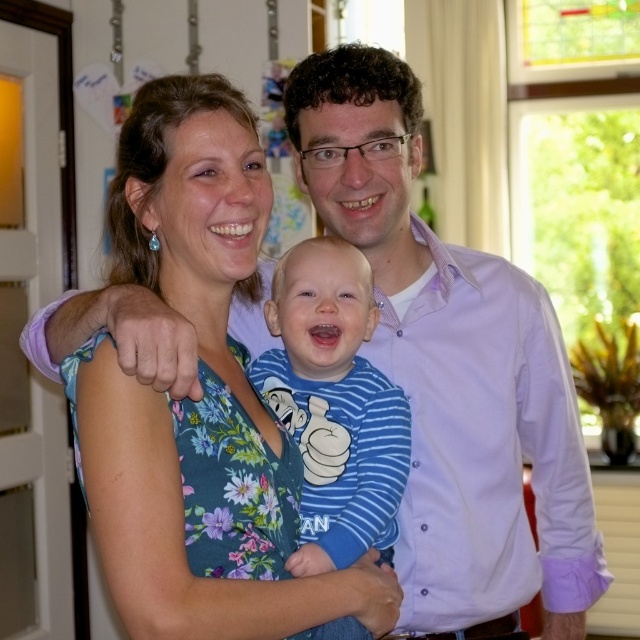
Please use the coordinates provided to identify which object is located at that point. The available objects are the woman in the floral dress at center and the man in the purple shirt on the right. Which one is at point (198,401)?

The point (198,401) corresponds to the floral fabric dress at center.

You are a photographer setting up for a family photo. You need to ensure that the floral fabric dress at center and the blue striped shirt at center are both visible in the frame. Based on their heights, which clothing item should you focus on first to ensure proper framing?

The floral fabric dress at center is taller than the blue striped shirt at center, so you should focus on framing the floral fabric dress at center first to ensure it is fully visible in the photo.